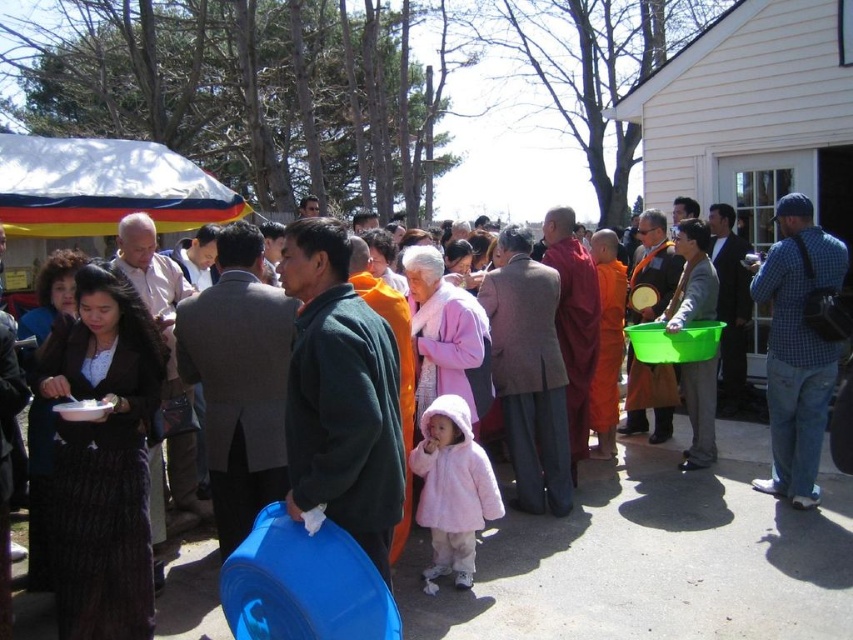
Question: Estimate the real-world distances between objects in this image. Which object is farther from the maroon silk robe at center?

Choices:
 (A) green cotton robe at center
 (B) dark green fleece at center
 (C) orange cloth at center
 (D) green plastic bucket at center

Answer: (B)

Question: Does velvet dark brown robe at left appear on the left side of orange cloth at center?

Choices:
 (A) no
 (B) yes

Answer: (B)

Question: Which of the following is the farthest from the observer?

Choices:
 (A) green fabric bucket at center-right
 (B) orange cotton robe at center
 (C) blue plaid shirt at right

Answer: (A)

Question: Can you confirm if velvet dark brown robe at left is smaller than green fabric bucket at center-right?

Choices:
 (A) yes
 (B) no

Answer: (A)

Question: Which object is the closest to the green cotton robe at center?

Choices:
 (A) blue plaid shirt at right
 (B) green fabric bucket at center-right

Answer: (A)

Question: Does dark green fleece at center have a greater width compared to orange cotton robe at center?

Choices:
 (A) no
 (B) yes

Answer: (A)